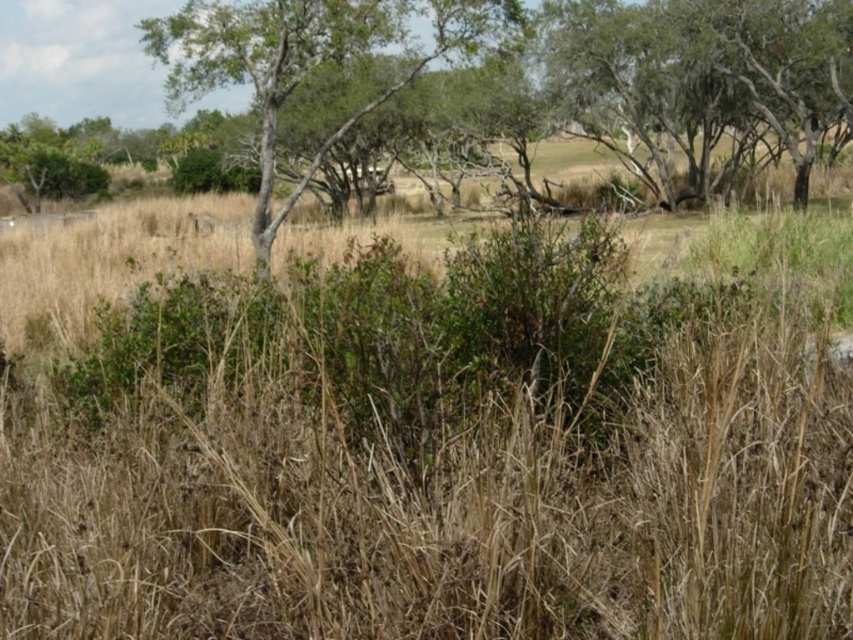
You are standing at the point labeled as point (700,83) in the image. What type of tree are you touching?

The point (700,83) is on a green rough bark tree at upper right.

You are a hiker standing at the center of the scene. You need to locate the green rough bark tree at upper right for your map coordinates. What are its coordinates?

The green rough bark tree at upper right is located at coordinates point (x=700, y=83).

You are a hiker standing in the scene and want to find shade. Which tree would provide more coverage? The green rough bark tree at upper right or the green leafy tree at center?

The green leafy tree at center provides more shade coverage because the green rough bark tree at upper right is positioned under it, meaning it is smaller and likely has a less dense canopy.